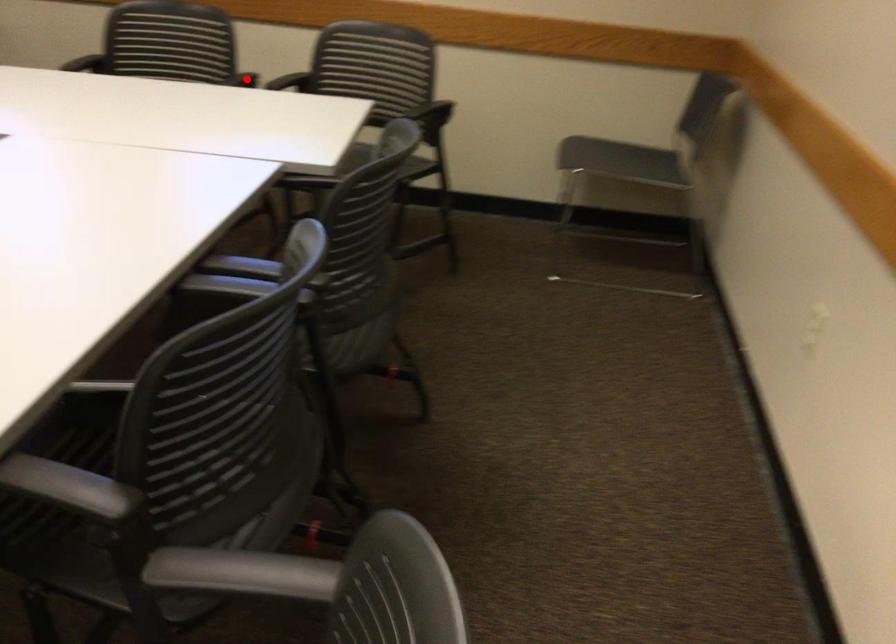
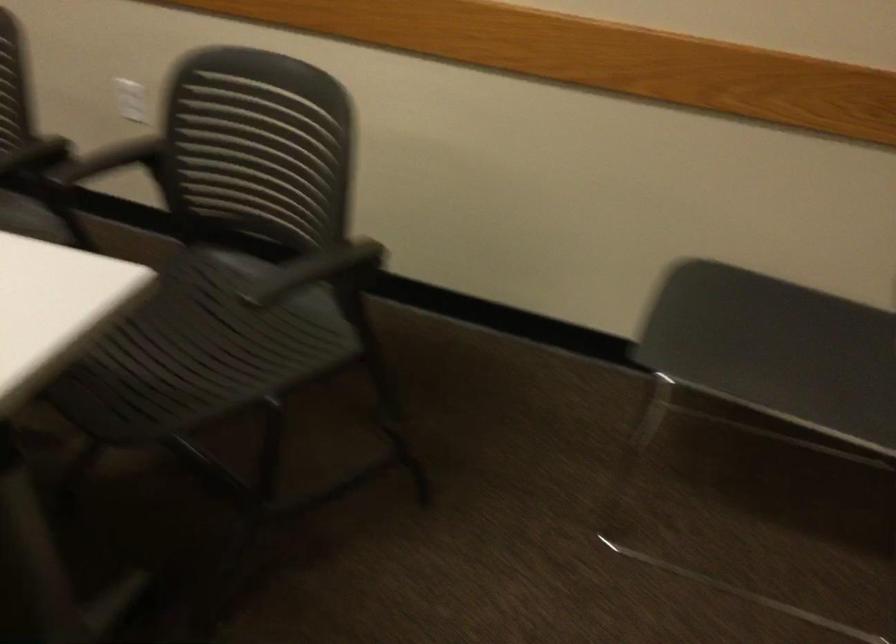
Find the pixel in the second image that matches the highlighted location in the first image.

(35, 156)